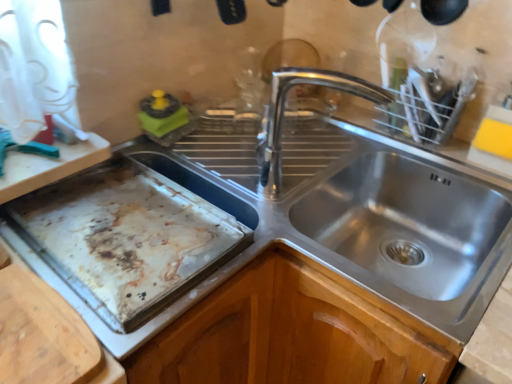
The width and height of the screenshot is (512, 384). Find the location of `polished metal tap at center`. polished metal tap at center is located at coordinates (283, 114).

Which of these two, stainless steel sink at center or polished metal tap at center, is wider?

With larger width is stainless steel sink at center.

Can you confirm if stainless steel sink at center is smaller than polished metal tap at center?

Incorrect, stainless steel sink at center is not smaller in size than polished metal tap at center.

Is stainless steel sink at center next to polished metal tap at center?

There is a gap between stainless steel sink at center and polished metal tap at center.

Consider the image. Considering the sizes of objects stainless steel sink at center and stained aluminum baking sheet at left in the image provided, who is smaller, stainless steel sink at center or stained aluminum baking sheet at left?

stained aluminum baking sheet at left is smaller.

Does stainless steel sink at center have a greater height compared to stained aluminum baking sheet at left?

Indeed, stainless steel sink at center has a greater height compared to stained aluminum baking sheet at left.

Is stainless steel sink at center further to camera compared to stained aluminum baking sheet at left?

No, it is not.

From the image's perspective, is stainless steel sink at center located beneath stained aluminum baking sheet at left?

Correct, stainless steel sink at center appears lower than stained aluminum baking sheet at left in the image.

From the image's perspective, is stained aluminum baking sheet at left under polished metal tap at center?

Correct, stained aluminum baking sheet at left appears lower than polished metal tap at center in the image.

Which is closer, (220, 263) or (347, 90)?

Point (220, 263) appears to be closer to the viewer than point (347, 90).

Does stained aluminum baking sheet at left lie behind polished metal tap at center?

No, stained aluminum baking sheet at left is closer to the camera.

Is polished metal tap at center wider than stainless steel sink at center?

Incorrect, the width of polished metal tap at center does not surpass that of stainless steel sink at center.

Which of these two, polished metal tap at center or stainless steel sink at center, is bigger?

With larger size is stainless steel sink at center.

From a real-world perspective, is polished metal tap at center physically located above or below stainless steel sink at center?

From a real-world perspective, polished metal tap at center is physically above stainless steel sink at center.

What's the angular difference between polished metal tap at center and stainless steel sink at center's facing directions?

The angular difference between polished metal tap at center and stainless steel sink at center is 19.9 degrees.

From a real-world perspective, is polished metal tap at center positioned under stained aluminum baking sheet at left based on gravity?

No, from a real-world perspective, polished metal tap at center is not beneath stained aluminum baking sheet at left.

Based on the photo, is polished metal tap at center at the left side of stained aluminum baking sheet at left?

No.

Is polished metal tap at center shorter than stained aluminum baking sheet at left?

No.

There is a stainless steel sink at center. At what (x,y) coordinates should I click in order to perform the action: click on baking sheet above it (from a real-world perspective). Please return your answer as a coordinate pair (x, y). The image size is (512, 384). Looking at the image, I should click on (133, 233).

Between stained aluminum baking sheet at left and stainless steel sink at center, which one has smaller size?

stained aluminum baking sheet at left.

Which object is further away from the camera taking this photo, stained aluminum baking sheet at left or stainless steel sink at center?

stained aluminum baking sheet at left is further from the camera.

Which is more to the right, stained aluminum baking sheet at left or stainless steel sink at center?

stainless steel sink at center.

Locate an element on the screen. tap that appears above the stainless steel sink at center (from a real-world perspective) is located at coordinates (283, 114).

In order to click on sink directly beneath the stained aluminum baking sheet at left (from a real-world perspective) in this screenshot , I will do `click(395, 217)`.

When comparing their distances from stained aluminum baking sheet at left, does stainless steel sink at center or polished metal tap at center seem closer?

The object closer to stained aluminum baking sheet at left is polished metal tap at center.

From the image, which object appears to be nearer to stainless steel sink at center, stained aluminum baking sheet at left or polished metal tap at center?

Based on the image, polished metal tap at center appears to be nearer to stainless steel sink at center.

Looking at the image, which one is located closer to polished metal tap at center, stained aluminum baking sheet at left or stainless steel sink at center?

stainless steel sink at center lies closer to polished metal tap at center than the other object.

Estimate the real-world distances between objects in this image. Which object is further from stainless steel sink at center, polished metal tap at center or stained aluminum baking sheet at left?

Among the two, stained aluminum baking sheet at left is located further to stainless steel sink at center.

Which object lies nearer to the anchor point stained aluminum baking sheet at left, polished metal tap at center or stainless steel sink at center?

polished metal tap at center lies closer to stained aluminum baking sheet at left than the other object.

Which object lies nearer to the anchor point polished metal tap at center, stainless steel sink at center or stained aluminum baking sheet at left?

The object closer to polished metal tap at center is stainless steel sink at center.

Where is `tap between stained aluminum baking sheet at left and stainless steel sink at center from left to right`? tap between stained aluminum baking sheet at left and stainless steel sink at center from left to right is located at coordinates coord(283,114).